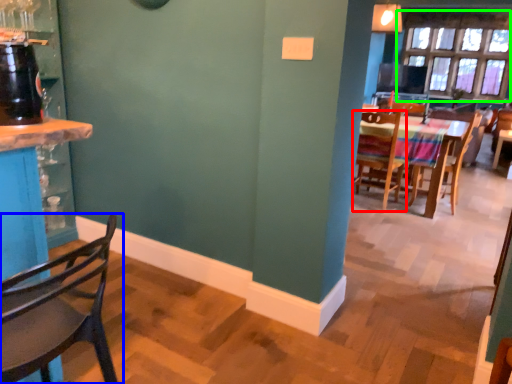
Question: Based on their relative distances, which object is farther from chair (highlighted by a red box)? Choose from chair (highlighted by a blue box) and window (highlighted by a green box).

Choices:
 (A) chair
 (B) window

Answer: (A)